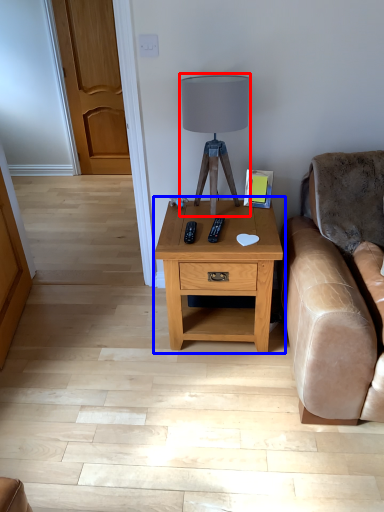
Question: Which of the following is the closest to the observer, table lamp (highlighted by a red box) or nightstand (highlighted by a blue box)?

Choices:
 (A) table lamp
 (B) nightstand

Answer: (A)